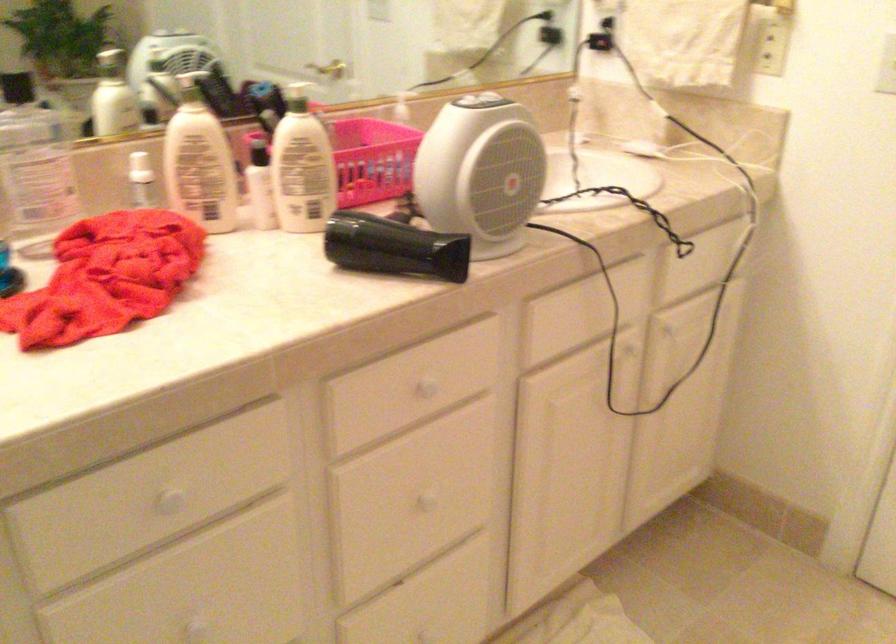
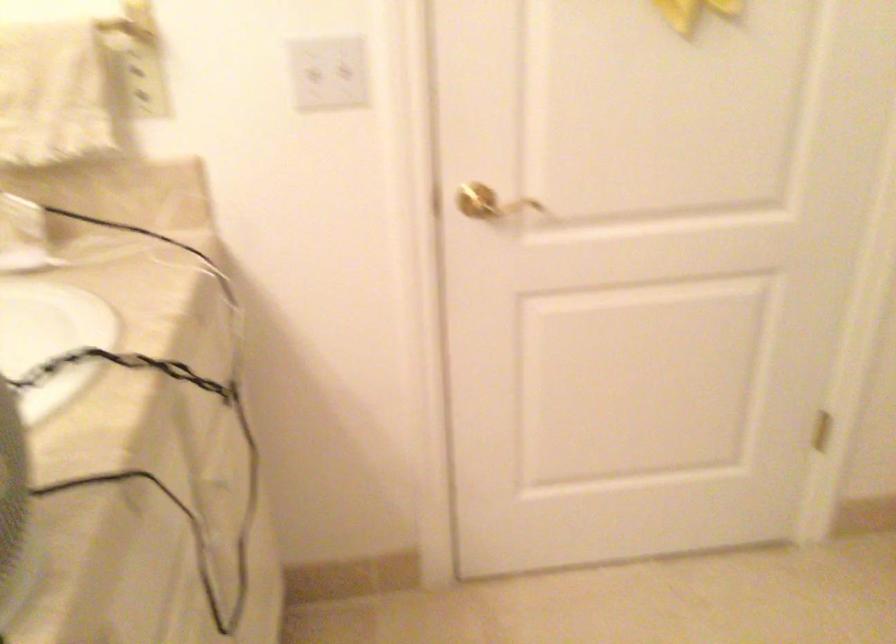
Question: The camera is either moving clockwise (left) or counter-clockwise (right) around the object. The first image is from the beginning of the video and the second image is from the end. Is the camera moving left or right when shooting the video?

Choices:
 (A) Left
 (B) Right

Answer: (A)